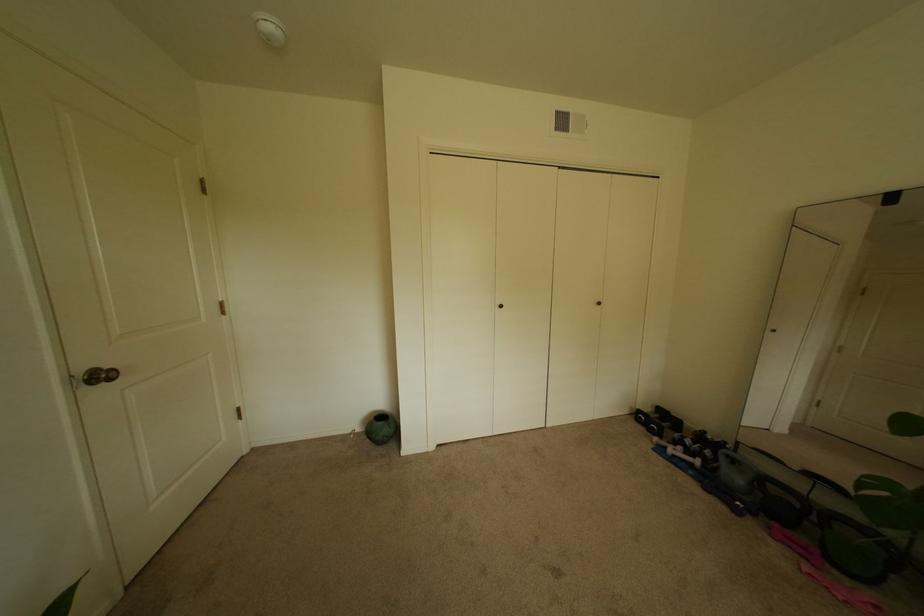
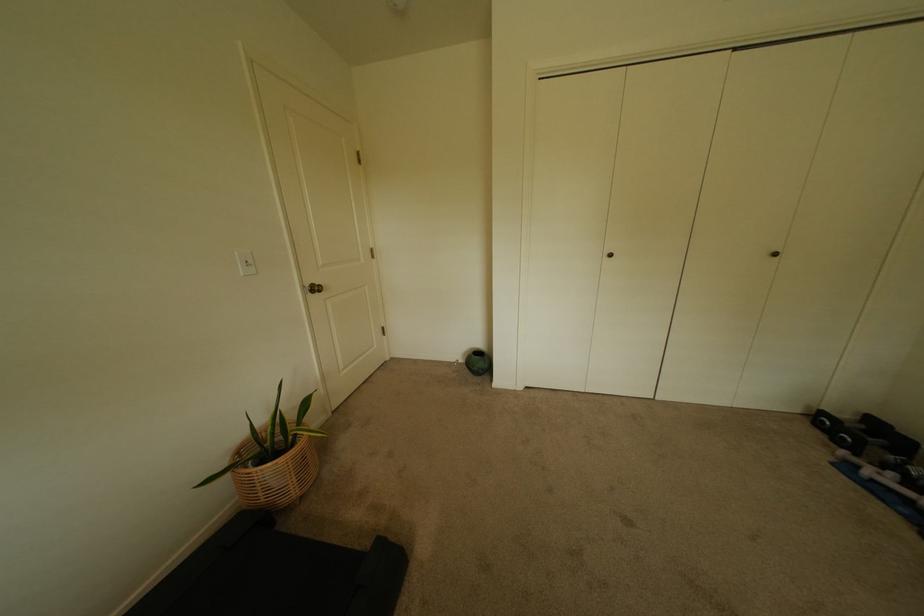
Find the pixel in the second image that matches (x=647, y=411) in the first image.

(831, 415)